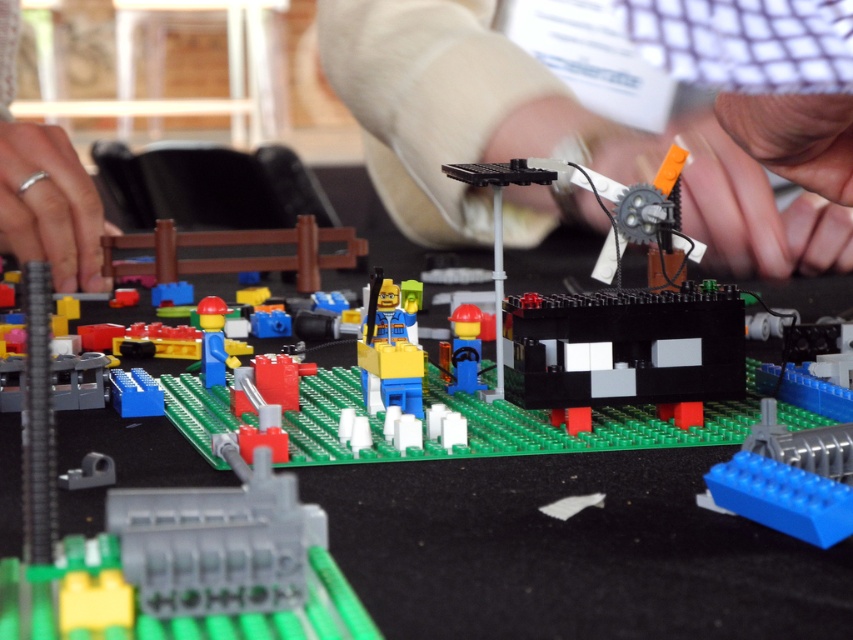
You are trying to place a new LEGO piece that is 3 cm wide. You have two options in the image, the smooth plastic hand at center and the silver metallic ring at lower left. Which one can the new piece fit next to without overlapping?

The smooth plastic hand at center might be wider than silver metallic ring at lower left, so the new piece can fit next to the silver metallic ring at lower left since it is narrower.

You are an observer looking at the LEGO construction scene. You notice a smooth plastic hand at center and a silver metallic ring at lower left. Which object is located to the right of the other?

The smooth plastic hand at center is positioned on the right side of silver metallic ring at lower left.